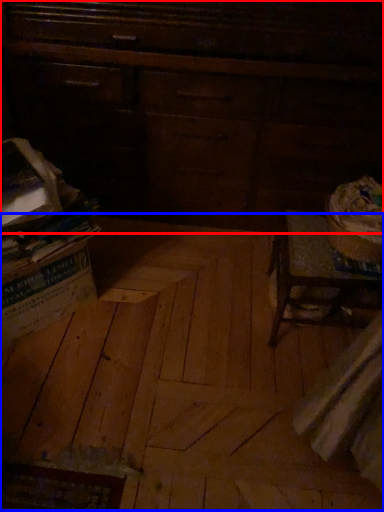
Question: Which object appears farthest to the camera in this image, furniture (highlighted by a red box) or plywood (highlighted by a blue box)?

Choices:
 (A) furniture
 (B) plywood

Answer: (A)